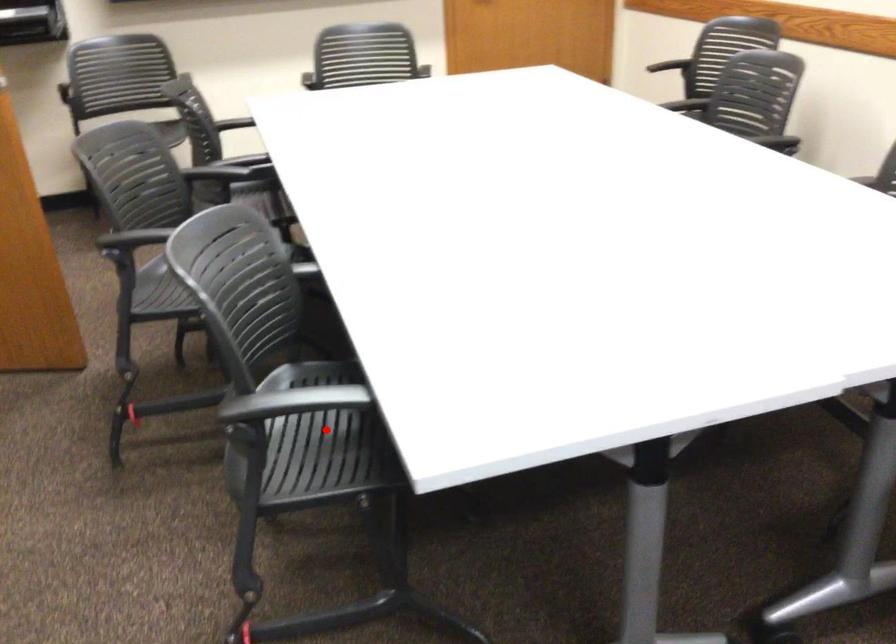
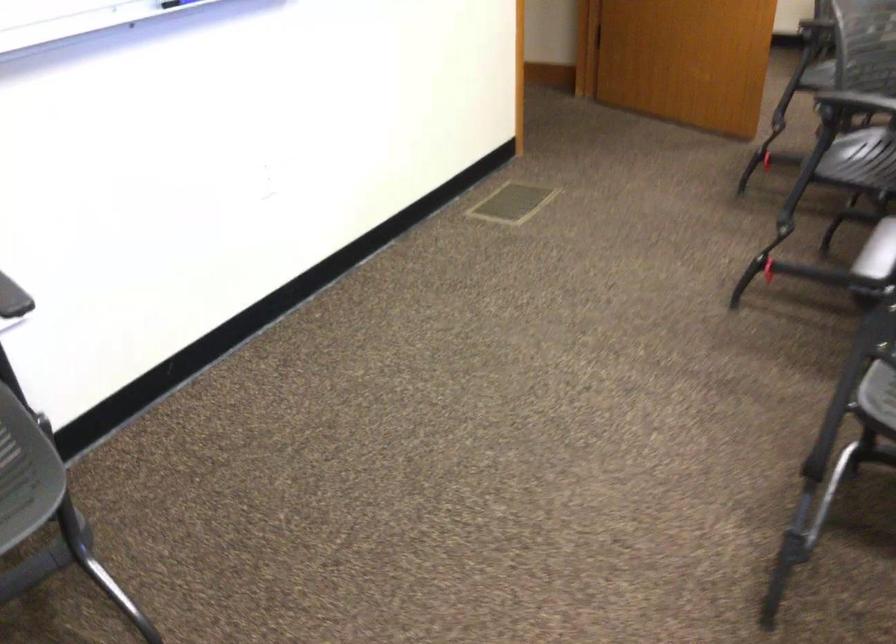
Question: I am providing you with two images of the same scene from different viewpoints. A red point is shown in image1. For the corresponding object point in image2, is it positioned nearer or farther from the camera?

Choices:
 (A) Nearer
 (B) Farther

Answer: (B)